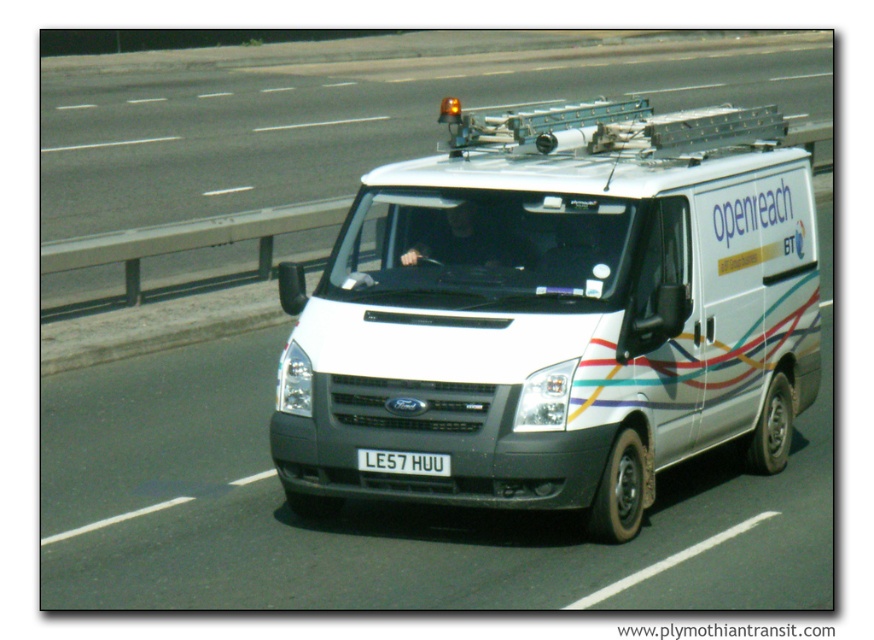
Based on the photo, is white matte van at center closer to camera compared to white plastic license plate at center?

Yes, it is.

Does white matte van at center have a smaller size compared to white plastic license plate at center?

Actually, white matte van at center might be larger than white plastic license plate at center.

Locate an element on the screen. white matte van at center is located at coordinates (557, 314).

Does white van at center have a smaller size compared to white plastic license plate at center?

No, white van at center is not smaller than white plastic license plate at center.

Is point (741, 100) farther from camera compared to point (440, 456)?

Yes, point (741, 100) is farther from viewer.

Does point (628, 84) lie behind point (380, 472)?

That is True.

Find the location of `white van at center`. white van at center is located at coordinates pyautogui.click(x=334, y=128).

Is white matte van at center to the left of white van at center from the viewer's perspective?

In fact, white matte van at center is to the right of white van at center.

Between white matte van at center and white van at center, which one has more height?

Standing taller between the two is white van at center.

Who is more forward, [424,241] or [514,100]?

Point [424,241] is more forward.

Identify the location of white matte van at center. (557, 314).